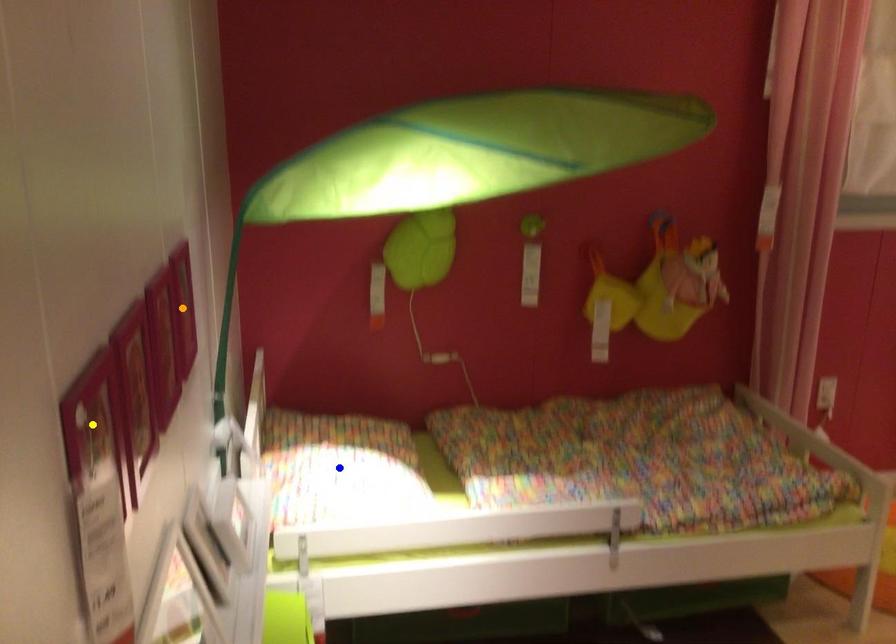
Order these from nearest to farthest:
yellow point | orange point | blue point

yellow point, orange point, blue point